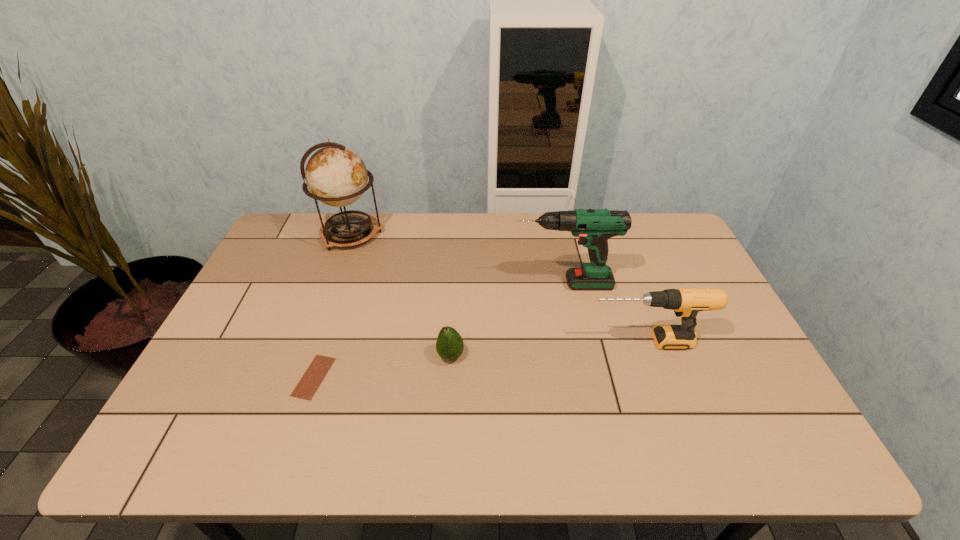
The image size is (960, 540). Find the location of `vacant space located 0.390m on the handle side of the taller drill`. vacant space located 0.390m on the handle side of the taller drill is located at coordinates 385,284.

This screenshot has width=960, height=540. Find the location of `free location located 0.160m on the handle side of the taller drill`. free location located 0.160m on the handle side of the taller drill is located at coordinates (460, 284).

Find the location of a particular element. This screenshot has width=960, height=540. free point located on the handle side of the taller drill is located at coordinates (492, 284).

Locate an element on the screen. The height and width of the screenshot is (540, 960). free region located on the handle side of the third shortest object is located at coordinates (502, 341).

Locate an element on the screen. The height and width of the screenshot is (540, 960). vacant space located on the handle side of the third shortest object is located at coordinates (468, 341).

The width and height of the screenshot is (960, 540). Identify the location of vacant space located 0.140m on the handle side of the third shortest object. click(x=535, y=341).

Where is `free space located 0.150m on the left of the third object from right to left`? The width and height of the screenshot is (960, 540). free space located 0.150m on the left of the third object from right to left is located at coordinates pos(379,356).

Where is `free space located 0.180m on the left of the chocolate bar`? free space located 0.180m on the left of the chocolate bar is located at coordinates [x=226, y=377].

The height and width of the screenshot is (540, 960). I want to click on object that is at the far edge, so click(x=335, y=175).

The image size is (960, 540). I want to click on object situated at the left edge, so click(x=335, y=175).